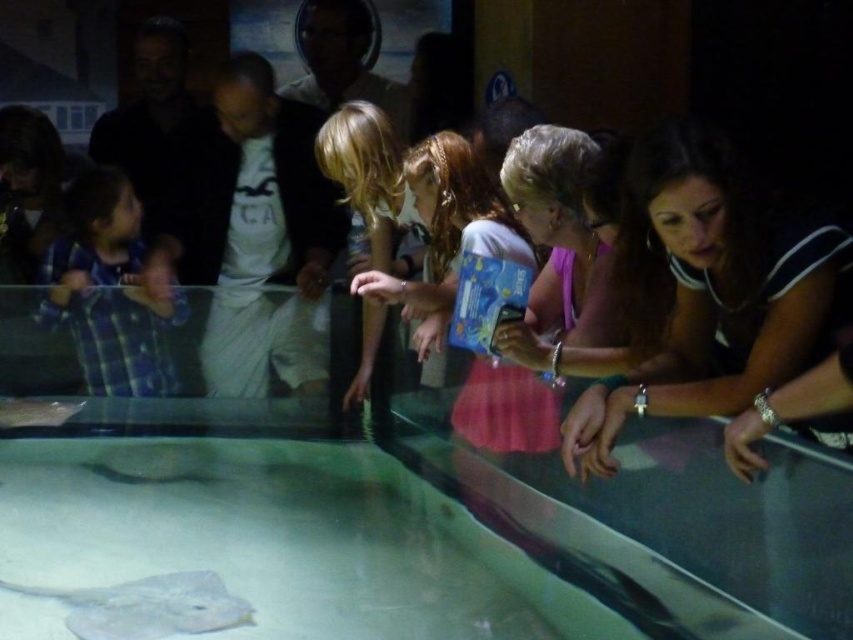
Question: Is blue plaid shirt at left to the right of pink satin dress at center from the viewer's perspective?

Choices:
 (A) yes
 (B) no

Answer: (B)

Question: Can you confirm if pink satin dress at center is smaller than gray matte stingray at lower left?

Choices:
 (A) yes
 (B) no

Answer: (B)

Question: Which object is farther from the camera taking this photo?

Choices:
 (A) blue plaid shirt at left
 (B) blonde hair at center
 (C) gray matte stingray at lower left
 (D) pink satin dress at center

Answer: (A)

Question: Is blue plaid shirt at left bigger than pink satin dress at center?

Choices:
 (A) no
 (B) yes

Answer: (B)

Question: Which of the following is the farthest from the observer?

Choices:
 (A) blonde hair at center
 (B) blue plaid shirt at left
 (C) gray matte stingray at lower left

Answer: (B)

Question: Which point appears farthest from the camera in this image?

Choices:
 (A) (224, 620)
 (B) (392, 244)
 (C) (107, 353)
 (D) (373, 280)

Answer: (C)